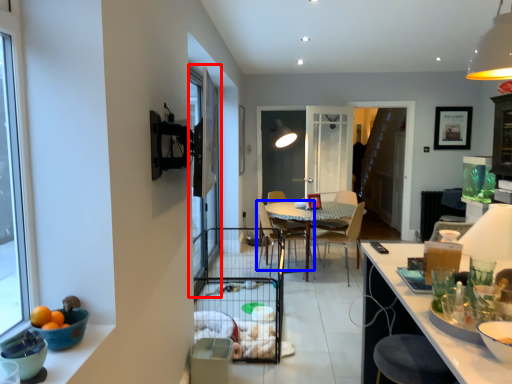
Question: Among these objects, which one is nearest to the camera, screen door (highlighted by a red box) or chair (highlighted by a blue box)?

Choices:
 (A) screen door
 (B) chair

Answer: (A)